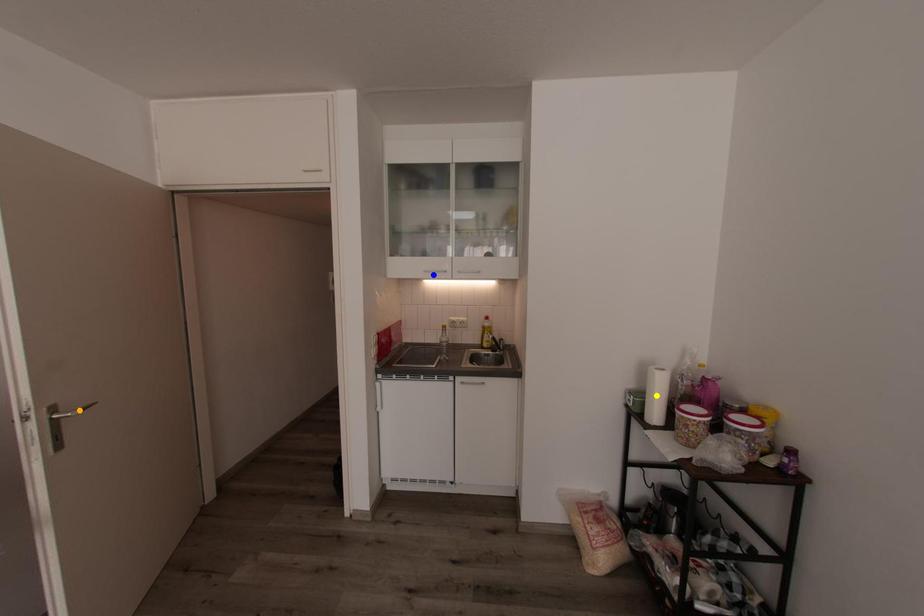
Order these from nearest to farthest:
A) blue point
B) yellow point
C) orange point

1. blue point
2. yellow point
3. orange point